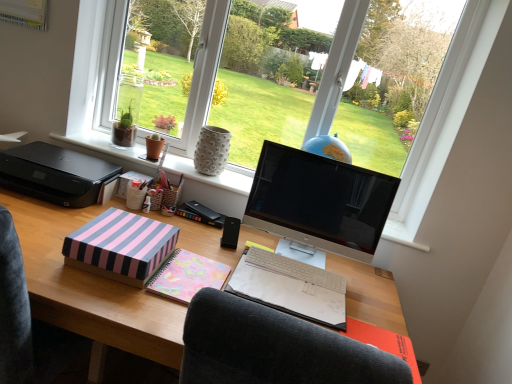
I want to click on free space above pink striped paper at center (from a real-world perspective), so (x=207, y=212).